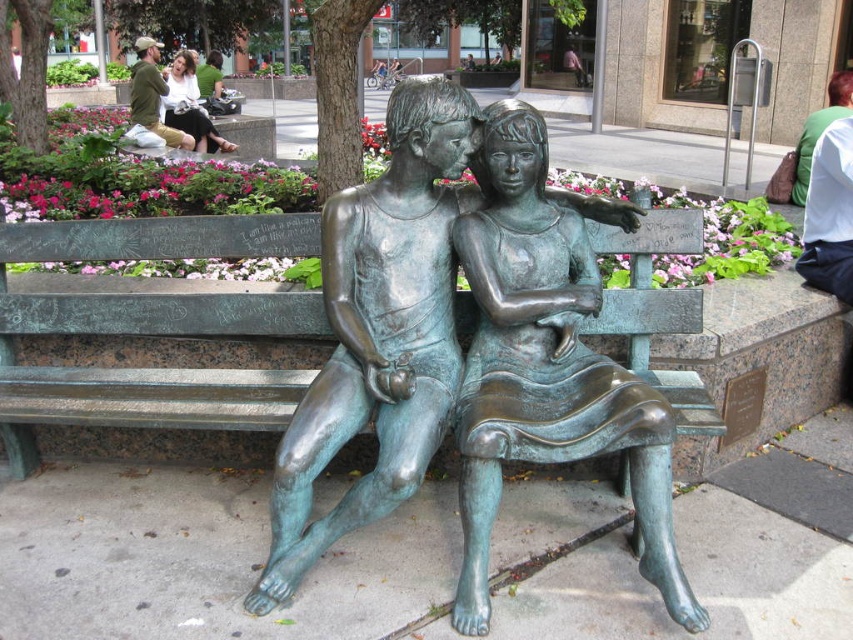
You are an art conservator examining the sculpture and bench. You need to determine the spatial relationship between the green patina bench at center and the green patina bronze statue at center. Which one is positioned to the left?

The green patina bench at center is positioned to the left of the green patina bronze statue at center.